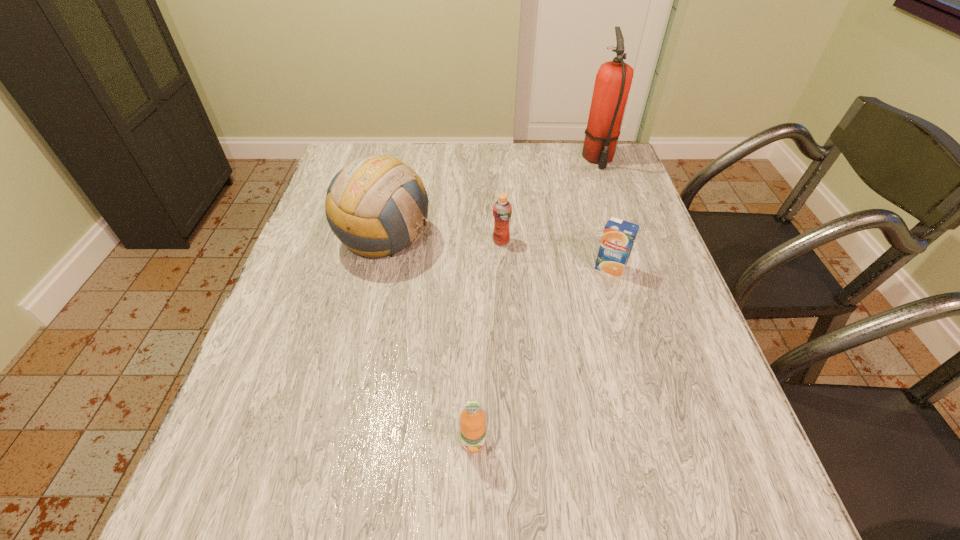
This screenshot has height=540, width=960. In the image, there is a desktop. In order to click on vacant space at the near edge in this screenshot , I will do `click(538, 515)`.

Identify the location of free point at the left edge. The image size is (960, 540). (325, 378).

Identify the location of vacant space at the right edge of the desktop. (685, 409).

I want to click on vacant position at the far left corner of the desktop, so click(x=362, y=152).

The width and height of the screenshot is (960, 540). I want to click on vacant region at the near left corner of the desktop, so click(231, 495).

Locate an element on the screen. This screenshot has height=540, width=960. vacant space at the far right corner of the desktop is located at coordinates tap(621, 176).

In the image, there is a desktop. Where is `vacant space at the near right corner`? Image resolution: width=960 pixels, height=540 pixels. vacant space at the near right corner is located at coordinates (685, 505).

Find the location of a particular element. vacant region between the rightmost orange juice and the fire extinguisher is located at coordinates (x=604, y=214).

The height and width of the screenshot is (540, 960). What are the coordinates of `vacant area that lies between the third object from right to left and the volleyball` in the screenshot? It's located at (444, 240).

Find the location of `vacant area between the leftmost object and the rightmost orange juice`. vacant area between the leftmost object and the rightmost orange juice is located at coordinates (498, 254).